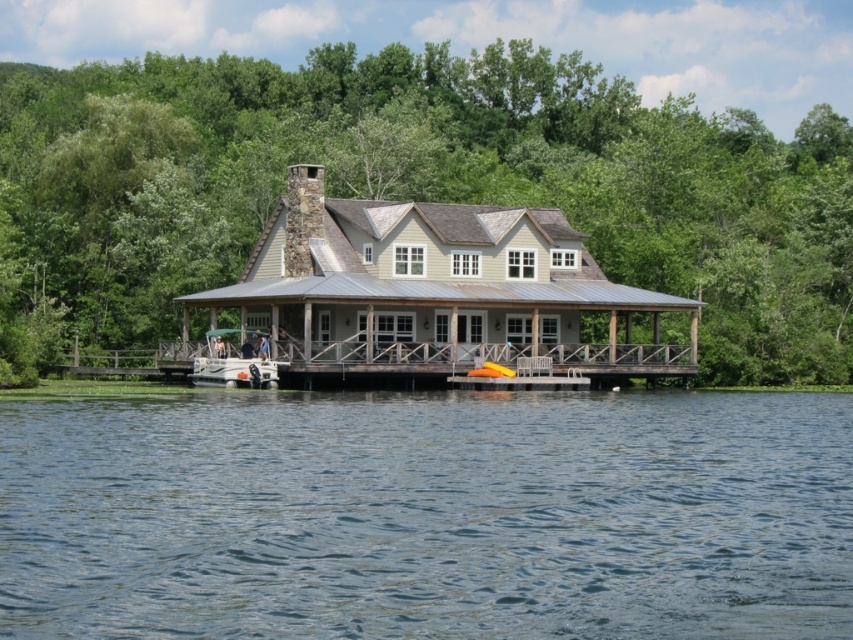
You are standing on the pier near the house and want to get to the white plastic boat at center. Which direction should you move relative to the clear blue water at center?

Since the clear blue water at center is in front of the white plastic boat at center, you should move behind the clear blue water at center to reach the white plastic boat at center.

You are planning to dock a new boat that is 3 meters wide. The wooden at center and white plastic boat at center are already present. Can your new boat fit alongside them without overlapping?

The wooden at center might be wider than white plastic boat at center, so there is uncertainty about available space. Measure the exact width of the wooden structure before deciding.

In the scene shown: You are standing at point (257, 340) and want to walk to the house. Is point (432, 365) located in front of you towards the house?

Yes, point (432, 365) is in front of point (257, 340), so it is located towards the house.